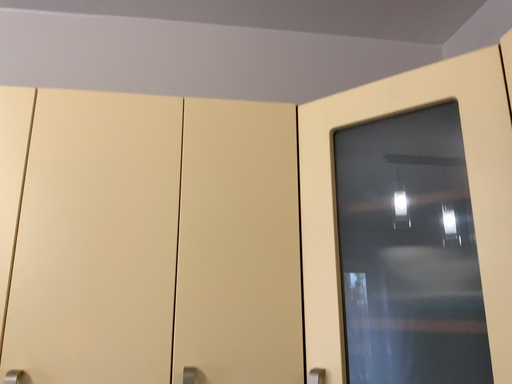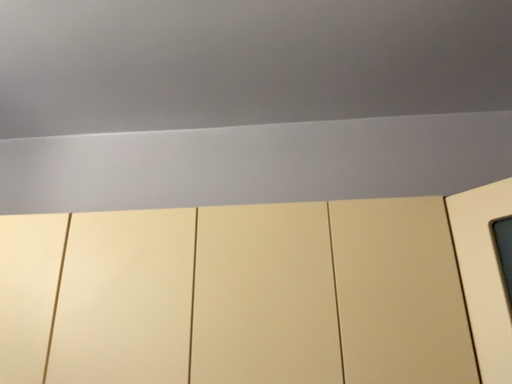
Question: How did the camera likely rotate when shooting the video?

Choices:
 (A) rotated upward
 (B) rotated downward

Answer: (A)